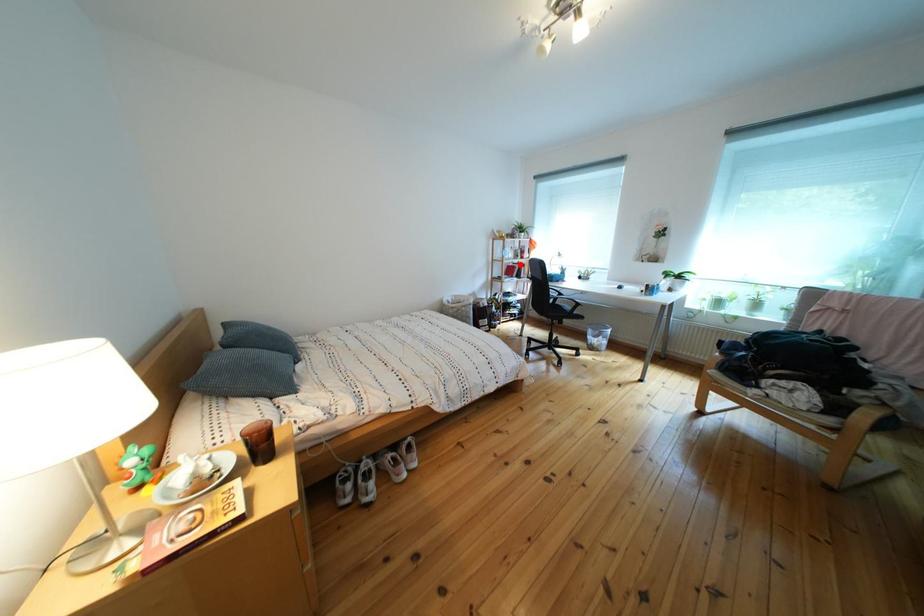
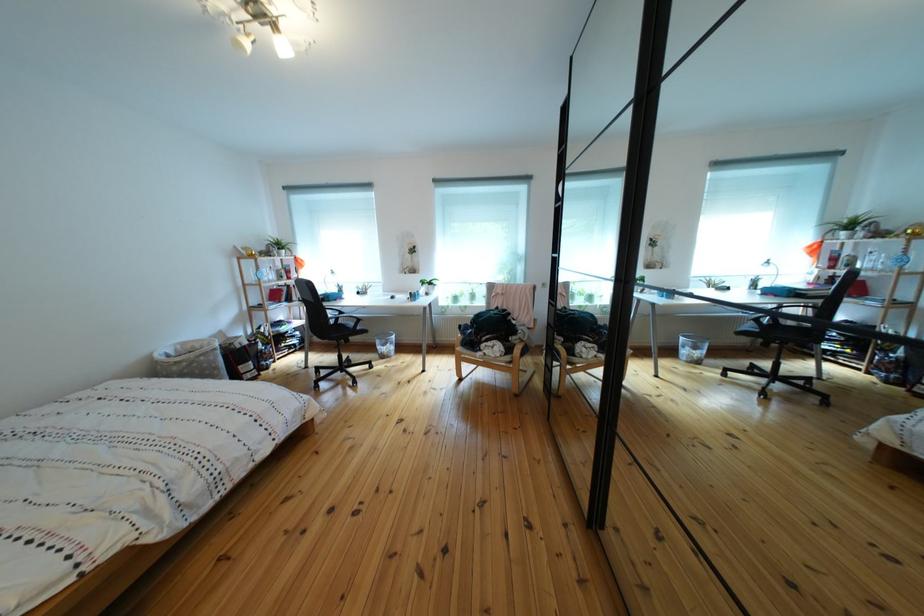
Find the pixel in the second image that matches the highlighted location in the first image.

(282, 286)